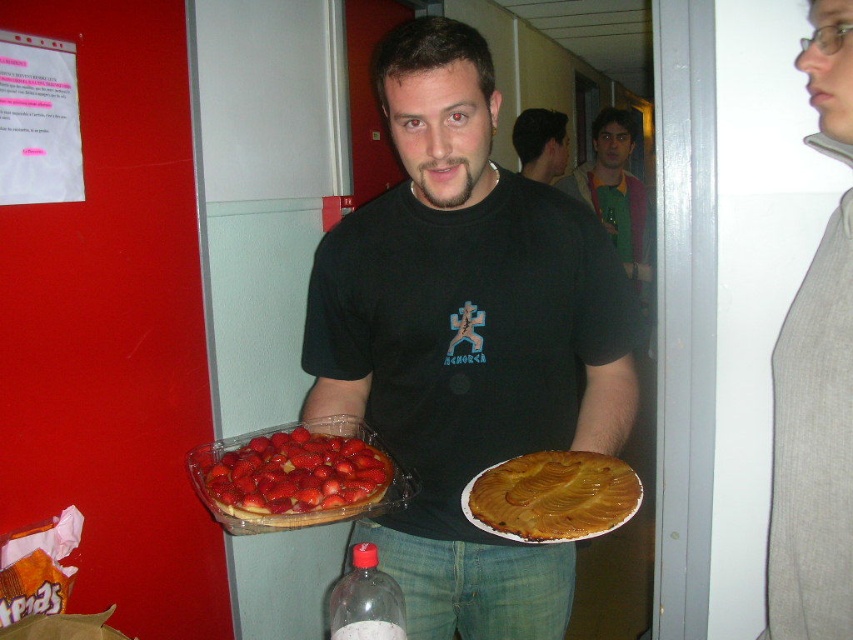
From the picture: Is green fabric shirt at upper center closer to the viewer compared to smooth black shirt at center?

Yes, green fabric shirt at upper center is in front of smooth black shirt at center.

Can you confirm if green fabric shirt at upper center is positioned to the right of smooth black shirt at center?

Indeed, green fabric shirt at upper center is positioned on the right side of smooth black shirt at center.

Between point (618, 177) and point (556, 113), which one is positioned behind?

The point (618, 177) is more distant.

At what (x,y) coordinates should I click in order to perform the action: click on green fabric shirt at upper center. Please return your answer as a coordinate pair (x, y). Looking at the image, I should click on tap(614, 189).

Does point (627, 483) come closer to viewer compared to point (345, 595)?

Yes, point (627, 483) is closer to viewer.

Who is higher up, golden caramelized pie at center or translucent plastic bottle at lower center?

golden caramelized pie at center is higher up.

Between point (532, 454) and point (379, 593), which one is positioned in front?

Point (532, 454) is more forward.

At what (x,y) coordinates should I click in order to perform the action: click on golden caramelized pie at center. Please return your answer as a coordinate pair (x, y). Looking at the image, I should click on (552, 497).

Does black matte t-shirt at center have a larger size compared to green fabric shirt at upper center?

Incorrect, black matte t-shirt at center is not larger than green fabric shirt at upper center.

Who is more distant from viewer, (467, 292) or (614, 237)?

The point (614, 237) is behind.

What do you see at coordinates (466, 339) in the screenshot? Image resolution: width=853 pixels, height=640 pixels. I see `black matte t-shirt at center` at bounding box center [466, 339].

Locate an element on the screen. Image resolution: width=853 pixels, height=640 pixels. black matte t-shirt at center is located at coordinates (466, 339).